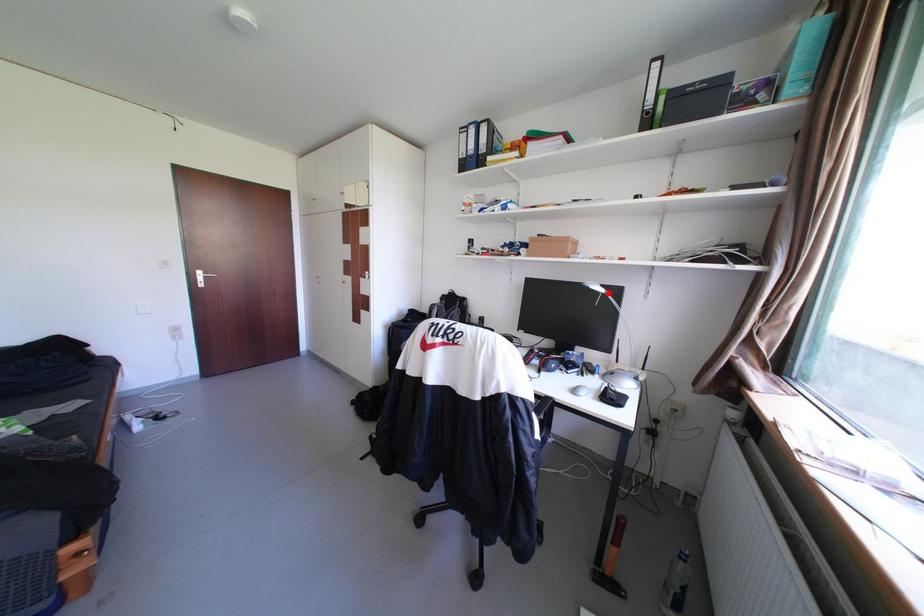
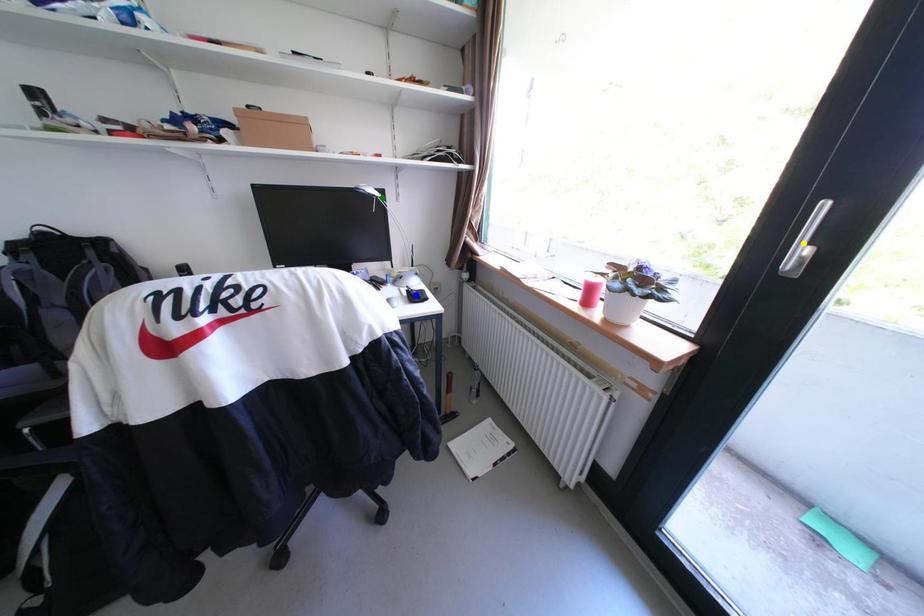
Question: I am providing you with two images of the same scene from different viewpoints. A red point is marked on the first image. You are given multiple points on the second image. Can you choose the point in image 2 that corresponds to the point in image 1?

Choices:
 (A) green point
 (B) yellow point
 (C) blue point

Answer: (A)